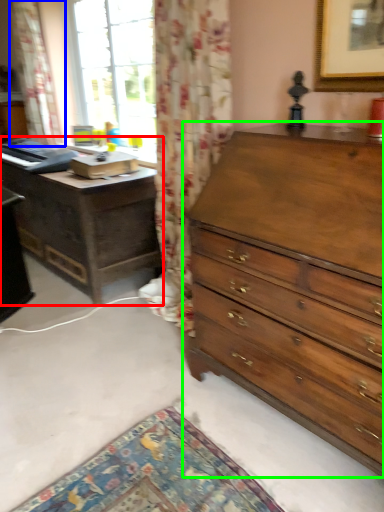
Question: Which object is positioned farthest from nightstand (highlighted by a red box)? Select from curtain (highlighted by a blue box) and chest of drawers (highlighted by a green box).

Choices:
 (A) curtain
 (B) chest of drawers

Answer: (B)